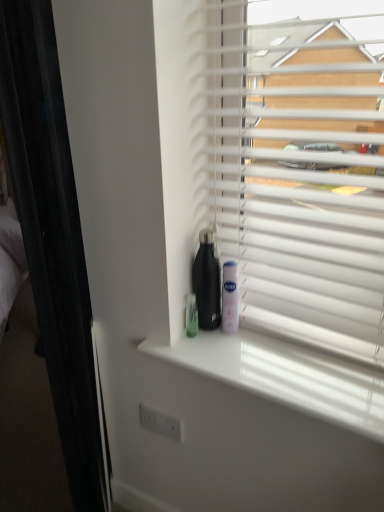
Locate an element on the screen. unoccupied region to the right of white plastic mouthwash at center is located at coordinates (272, 346).